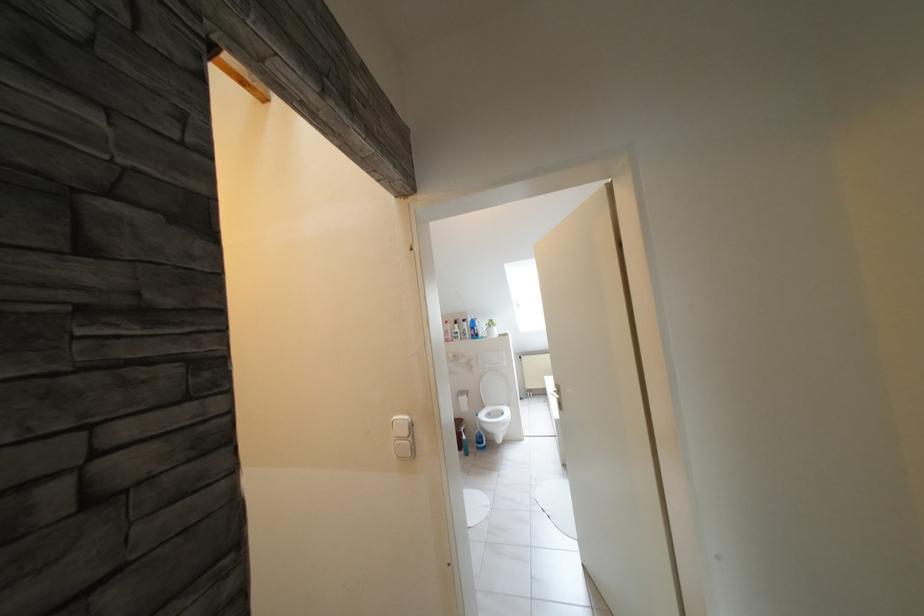
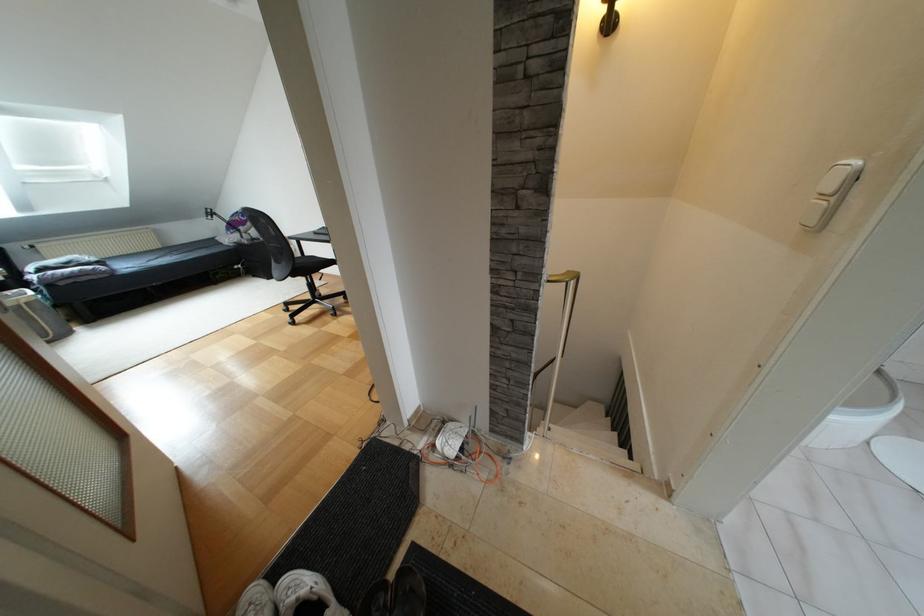
The point at (408,438) is marked in the first image. Where is the corresponding point in the second image?

(833, 198)